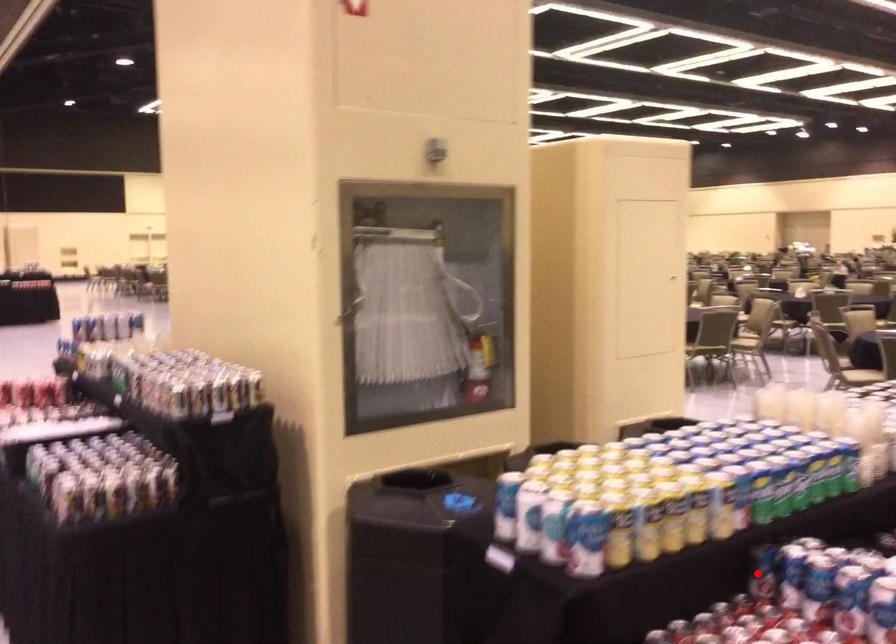
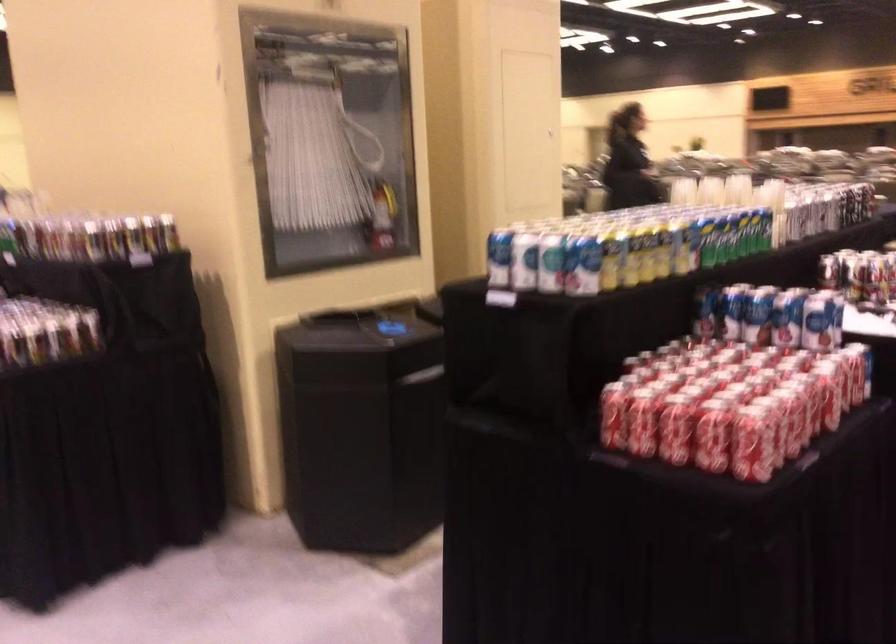
Where in the second image is the point corresponding to the highlighted location from the first image?

(703, 312)